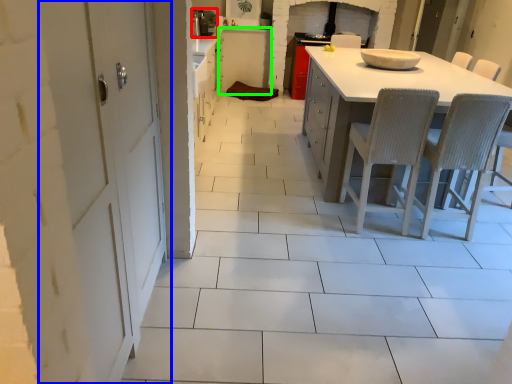
Question: Which is nearer to the appliance (highlighted by a red box)? door (highlighted by a blue box) or cabinetry (highlighted by a green box).

Choices:
 (A) door
 (B) cabinetry

Answer: (B)